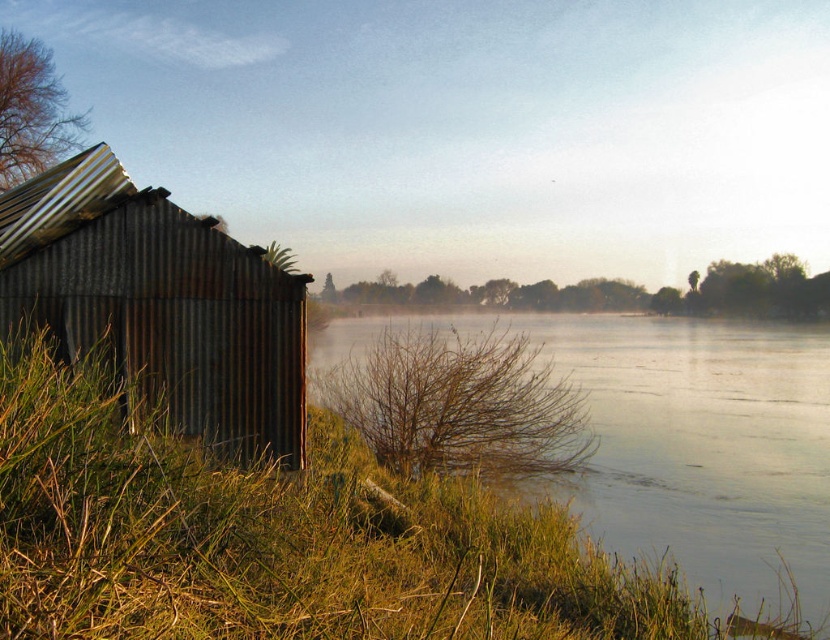
Can you confirm if green grassy river at lower left is positioned above rusty corrugated hut at left?

Incorrect, green grassy river at lower left is not positioned above rusty corrugated hut at left.

Is point (733, 557) behind point (293, 342)?

Yes, it is.

Identify the location of green grassy river at lower left. The width and height of the screenshot is (830, 640). (675, 442).